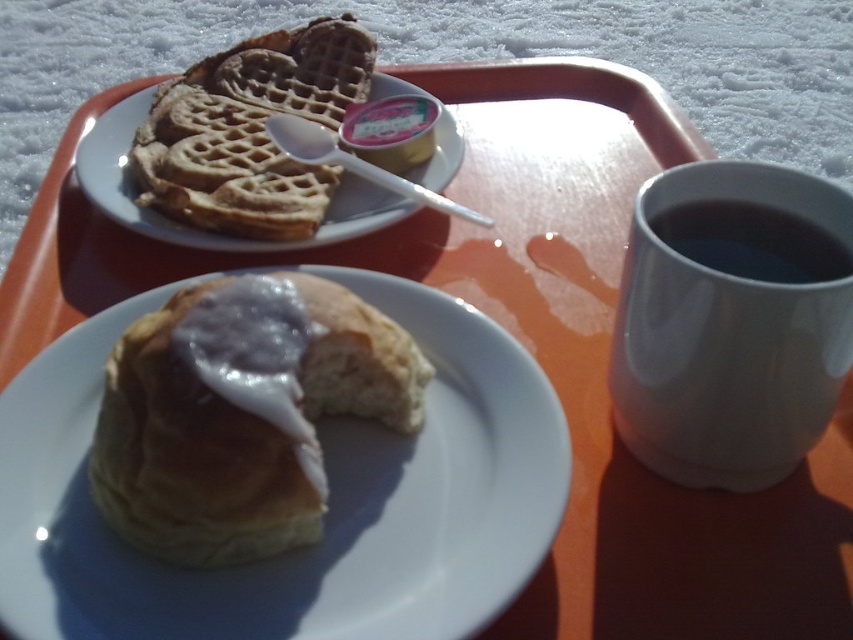
You are a delivery robot carrying a package that needs to be placed on the breakfast tray. The package is 10 cm in height. The tray has limited space between the objects. The glazed pastry at center and the golden brown waffle at upper left are on the tray. Which object should you place the package next to so it won

The glazed pastry at center is closer to the viewer than the golden brown waffle at upper left. Therefore, placing the package next to the golden brown waffle at upper left would provide more vertical space since it is farther away from the viewer, allowing the package to fit without obstruction.

You are a guest at a cozy cabin and want to grab the largest item on the tray to take a photo. Which item should you choose between the glazed pastry at center and the white glossy mug at upper right?

The glazed pastry at center is larger in size than the white glossy mug at upper right, so you should choose the glazed pastry at center for your photo.